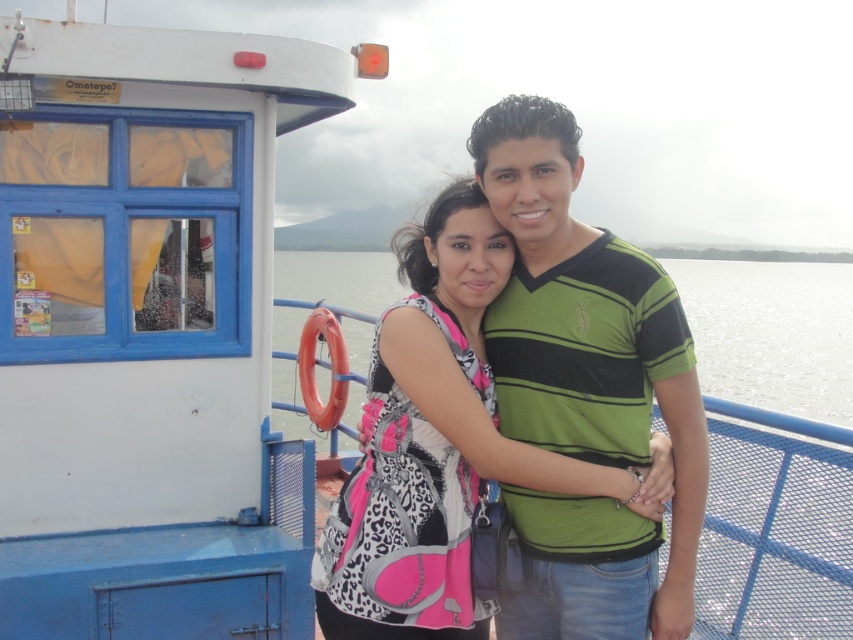
Question: Is the position of green striped shirt at center less distant than that of pink leopard print backpack at center?

Choices:
 (A) no
 (B) yes

Answer: (B)

Question: Among these points, which one is farthest from the camera?

Choices:
 (A) (595, 445)
 (B) (619, 490)

Answer: (A)

Question: Is green striped shirt at center in front of pink leopard print backpack at center?

Choices:
 (A) no
 (B) yes

Answer: (B)

Question: Which object appears farthest from the camera in this image?

Choices:
 (A) green striped shirt at center
 (B) pink leopard print backpack at center

Answer: (B)

Question: Is green striped shirt at center thinner than pink leopard print backpack at center?

Choices:
 (A) no
 (B) yes

Answer: (B)